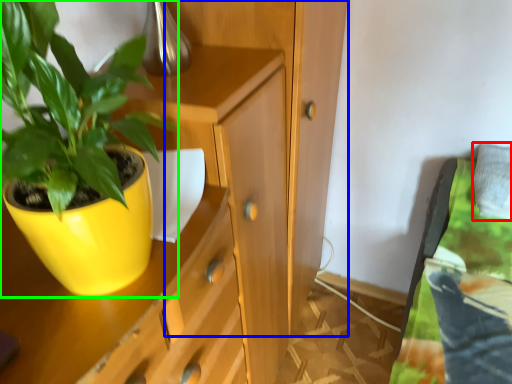
Question: Which is nearer to the pillow (highlighted by a red box)? dresser (highlighted by a blue box) or houseplant (highlighted by a green box).

Choices:
 (A) dresser
 (B) houseplant

Answer: (A)